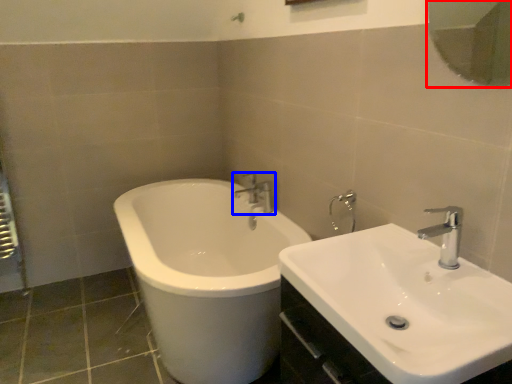
Question: Which of the following is the closest to the observer, mirror (highlighted by a red box) or tap (highlighted by a blue box)?

Choices:
 (A) mirror
 (B) tap

Answer: (A)